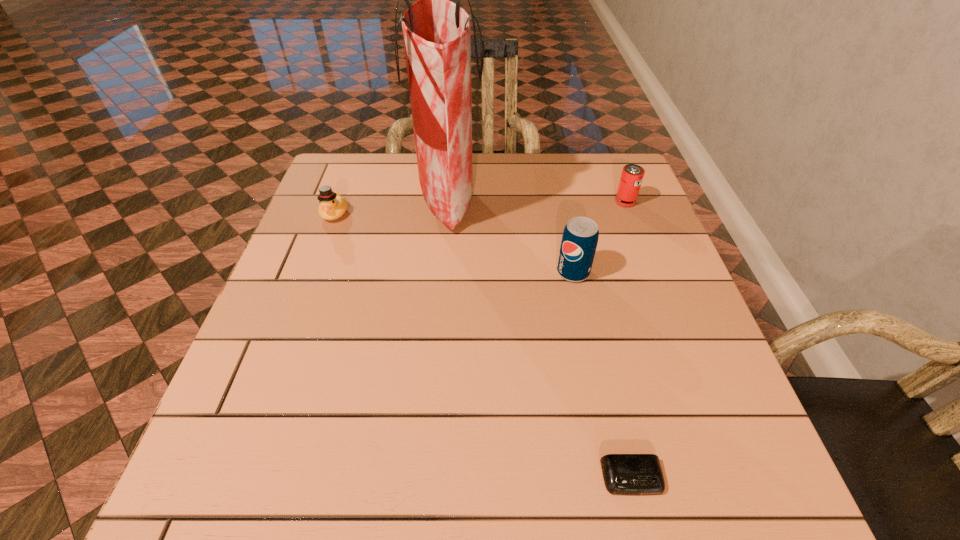
The width and height of the screenshot is (960, 540). Identify the location of vacant space located 0.190m on the front of the second nearest object. (590, 357).

Identify the location of vacant space located on the front of the rightmost object. (636, 232).

This screenshot has height=540, width=960. I want to click on free region located 0.250m on the front-facing side of the leftmost object, so click(302, 301).

Image resolution: width=960 pixels, height=540 pixels. Find the location of `grocery bag that is at the far edge`. grocery bag that is at the far edge is located at coordinates (437, 33).

I want to click on can that is at the far edge, so click(632, 175).

Where is `duck located at the far edge`? duck located at the far edge is located at coordinates (332, 206).

What are the coordinates of `object situated at the near edge` in the screenshot? It's located at (624, 474).

Image resolution: width=960 pixels, height=540 pixels. Find the location of `object that is at the left edge`. object that is at the left edge is located at coordinates (332, 206).

The height and width of the screenshot is (540, 960). What are the coordinates of `can positioned at the right edge` in the screenshot? It's located at (632, 175).

Locate an element on the screen. Image resolution: width=960 pixels, height=540 pixels. alarm clock that is at the right edge is located at coordinates (624, 474).